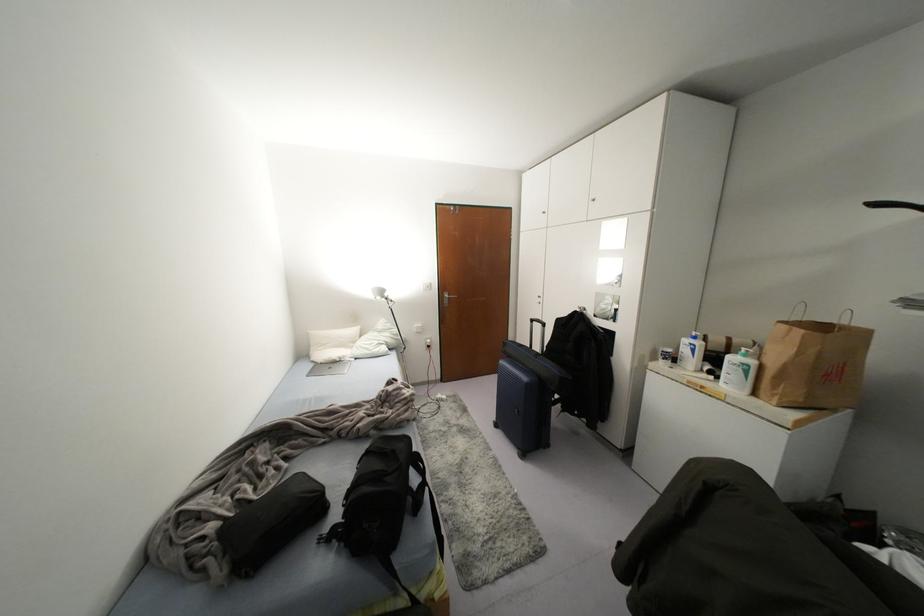
Find where to pull the silver door handle. Please return your answer as a coordinate pair (x, y).

(447, 298)